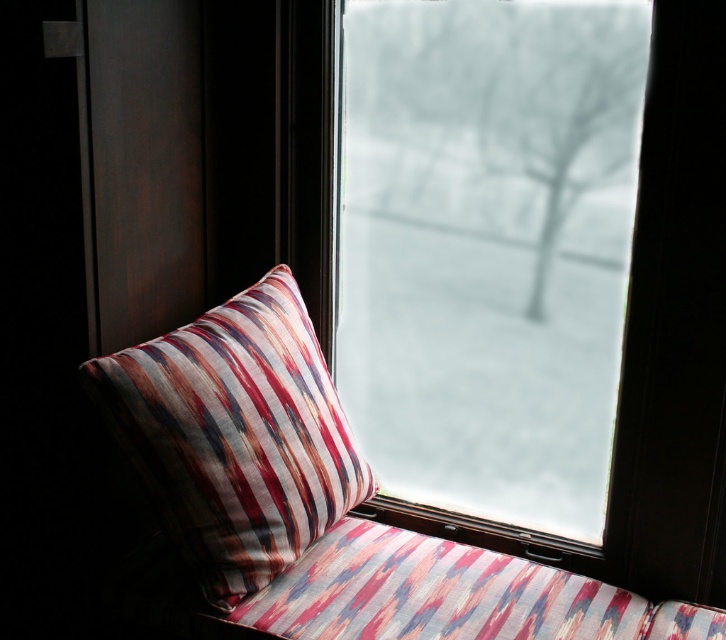
Question: From the image, what is the correct spatial relationship of transparent glass window at center in relation to striped fabric pillow at center?

Choices:
 (A) right
 (B) left

Answer: (A)

Question: Does transparent glass window at center have a lesser width compared to striped fabric pillow at center?

Choices:
 (A) yes
 (B) no

Answer: (B)

Question: Which point appears closest to the camera in this image?

Choices:
 (A) (115, 376)
 (B) (363, 420)

Answer: (A)

Question: Is transparent glass window at center to the right of striped fabric pillow at center from the viewer's perspective?

Choices:
 (A) yes
 (B) no

Answer: (A)

Question: Which of the following is the closest to the observer?

Choices:
 (A) (334, 497)
 (B) (372, 412)

Answer: (A)